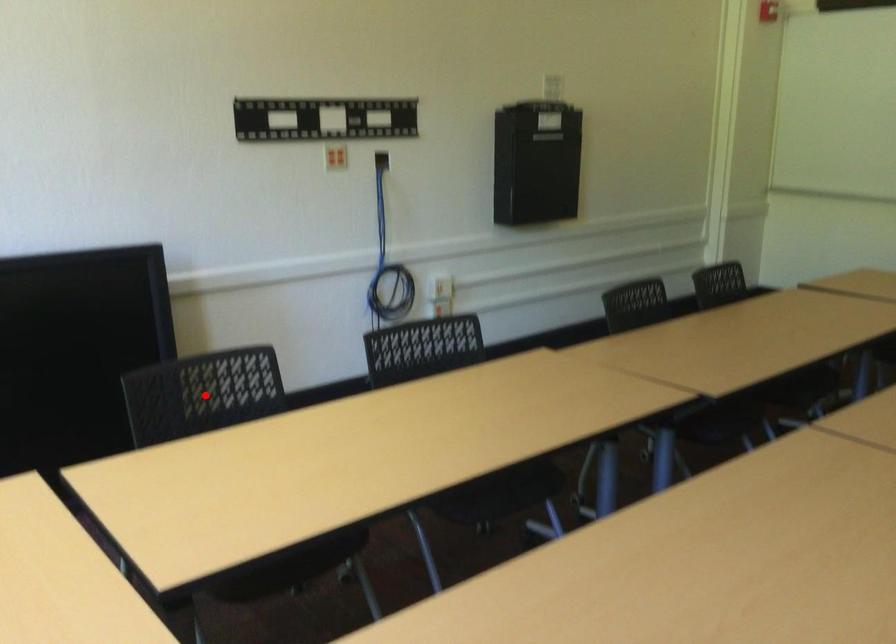
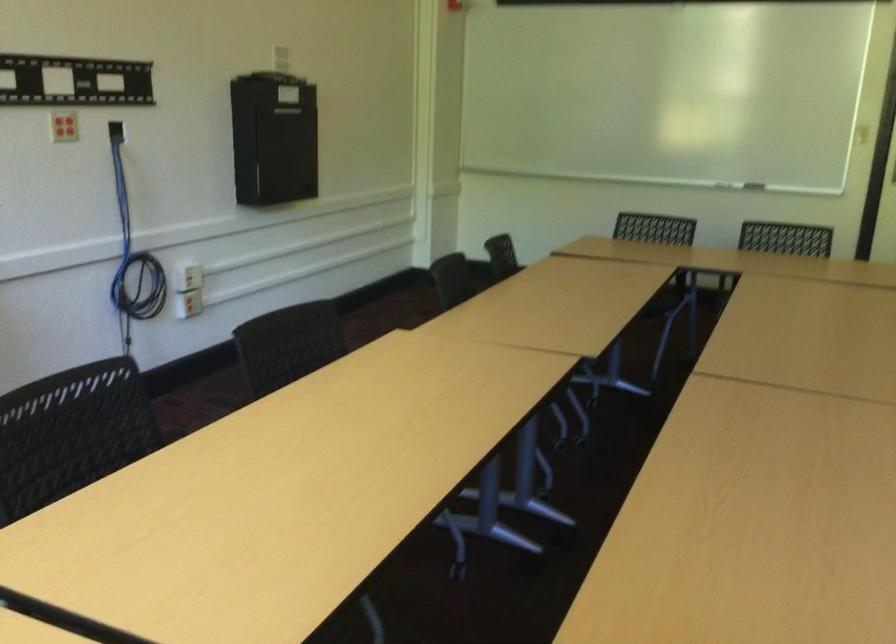
Question: A red point is marked in image1. In image2, is the corresponding 3D point closer to the camera or farther? Reply with the corresponding letter.

Choices:
 (A) The corresponding 3D point is closer.
 (B) The corresponding 3D point is farther.

Answer: (A)